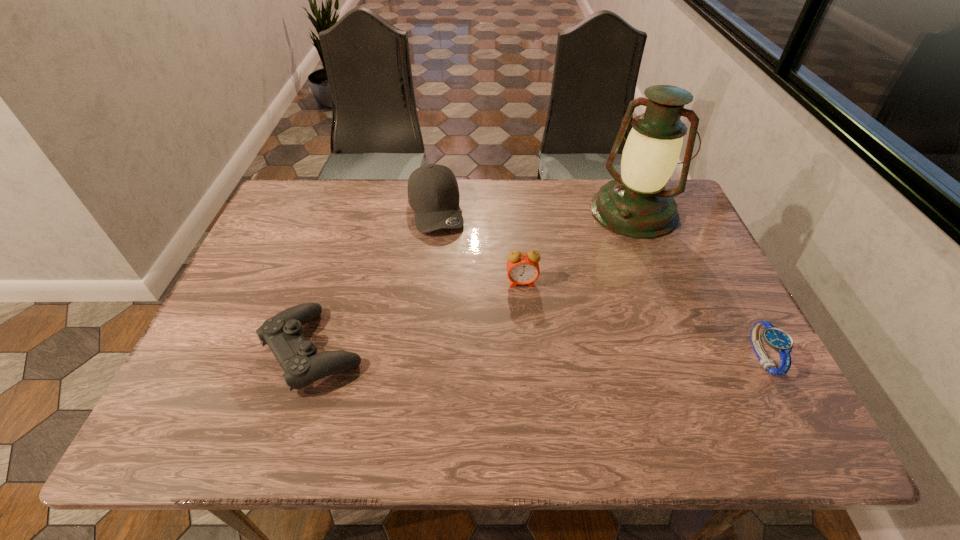
Where is `vacant region located 0.230m on the front brim of the fourth object from right to left`? The width and height of the screenshot is (960, 540). vacant region located 0.230m on the front brim of the fourth object from right to left is located at coordinates (457, 296).

Where is `vacant space located on the face of the third nearest object`? vacant space located on the face of the third nearest object is located at coordinates (528, 342).

You are a GUI agent. You are given a task and a screenshot of the screen. Output one action in this format:
    pyautogui.click(x=<x>, y=<y>)
    Task: Click on the vacant region located on the face of the third nearest object
    Image resolution: width=960 pixels, height=540 pixels.
    Given the screenshot: What is the action you would take?
    (x=529, y=357)

This screenshot has width=960, height=540. In order to click on free spot located 0.100m on the face of the third nearest object in this screenshot , I will do `click(525, 319)`.

Image resolution: width=960 pixels, height=540 pixels. In order to click on free space located with the light compartment facing forward on the tallest object in this screenshot , I will do `click(583, 279)`.

At what (x,y) coordinates should I click in order to perform the action: click on vacant position located 0.340m with the light compartment facing forward on the tallest object. Please return your answer as a coordinate pair (x, y). The image size is (960, 540). Looking at the image, I should click on (561, 307).

The image size is (960, 540). Find the location of `free point located 0.210m with the light compartment facing forward on the tallest object`. free point located 0.210m with the light compartment facing forward on the tallest object is located at coordinates (585, 276).

Find the location of a particular element. This screenshot has width=960, height=540. baseball cap that is at the far edge is located at coordinates (433, 193).

Where is `lantern present at the far edge`? lantern present at the far edge is located at coordinates (635, 204).

Locate an element on the screen. The width and height of the screenshot is (960, 540). control that is at the near edge is located at coordinates (297, 356).